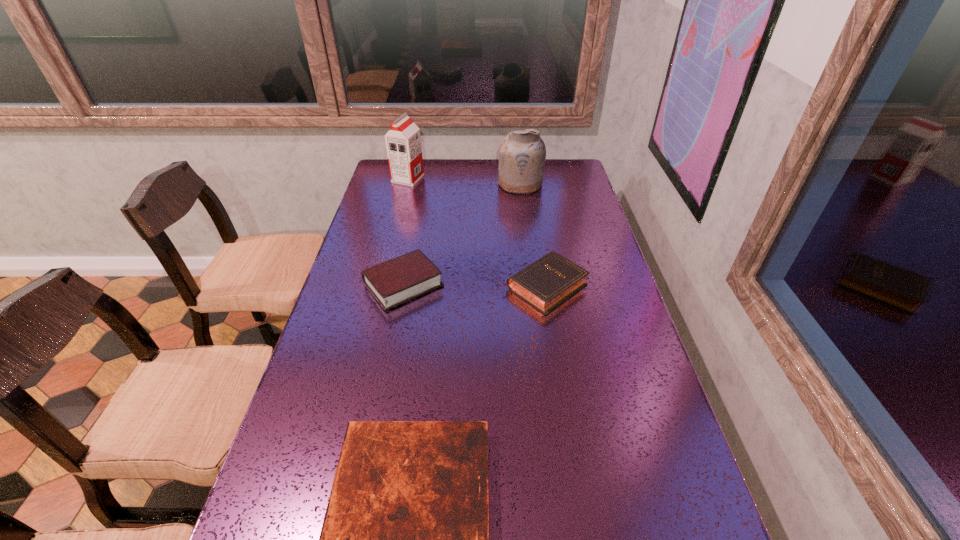
This screenshot has height=540, width=960. Identify the location of the second closest object to the nearest object. (396, 281).

Where is `the third closest Bible to the soya milk`? This screenshot has width=960, height=540. the third closest Bible to the soya milk is located at coordinates (405, 539).

You are a GUI agent. You are given a task and a screenshot of the screen. Output one action in this format:
    pyautogui.click(x=<x>, y=<y>)
    Task: Click on the Bible object that ranks as the closest to the rightmost Bible
    This screenshot has width=960, height=540.
    Given the screenshot: What is the action you would take?
    pyautogui.click(x=396, y=281)